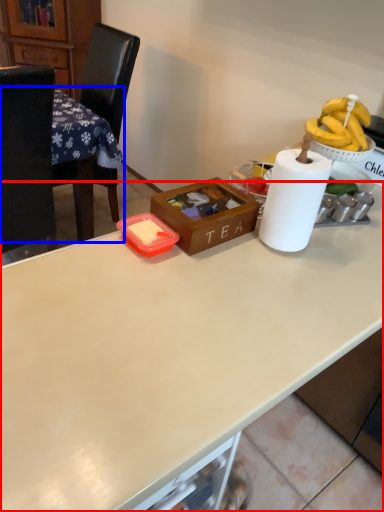
Question: Which of the following is the closest to the observer, desk (highlighted by a red box) or table (highlighted by a blue box)?

Choices:
 (A) desk
 (B) table

Answer: (A)